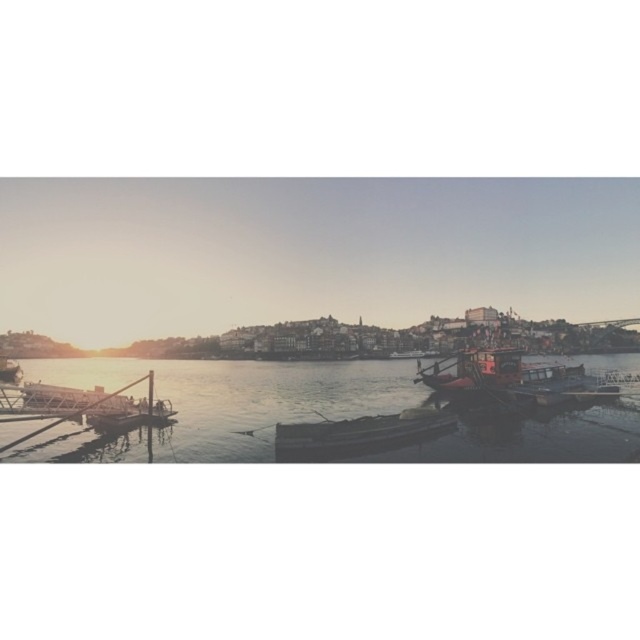
You are planning to park your small boat that is 2 meters wide. You see the metallic dock at lower left and the wooden boat at center. Which dock can accommodate your boat based on their widths?

The metallic dock at lower left has a larger width than the wooden boat at center, so it can accommodate your boat that is 2 meters wide.

You are standing at point (420,419) and want to walk to point (353,376). According to the scene description, which direction should you face to move towards your destination?

You should face towards the direction opposite of point (420,419) because point (353,376) is behind it.